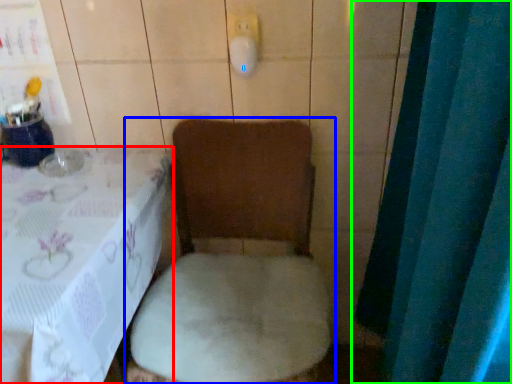
Question: Estimate the real-world distances between objects in this image. Which object is closer to furniture (highlighted by a red box), toilet (highlighted by a blue box) or curtain (highlighted by a green box)?

Choices:
 (A) toilet
 (B) curtain

Answer: (A)